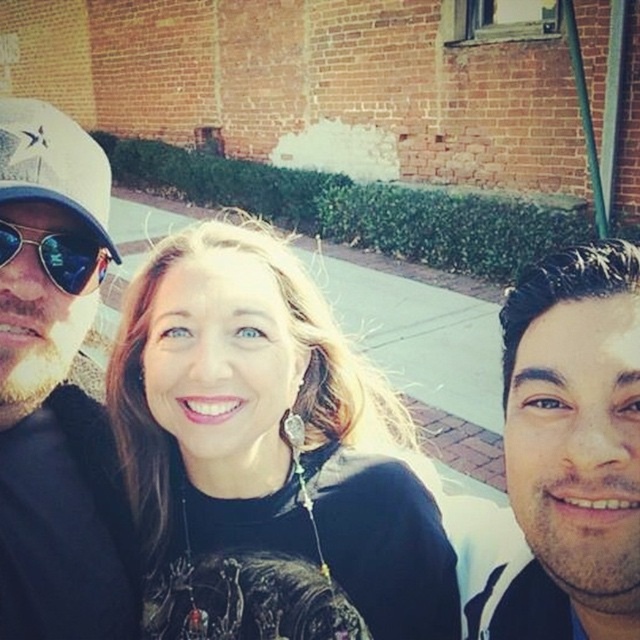
Measure the distance between white matte face at right and camera.

The distance of white matte face at right from camera is 26.31 inches.

Can you confirm if white matte face at right is positioned to the right of matte black sunglasses at left?

Yes, white matte face at right is to the right of matte black sunglasses at left.

Locate an element on the screen. This screenshot has height=640, width=640. white matte face at right is located at coordinates (x=570, y=451).

Does matte black shirt at center come in front of matte black cap at left?

That is False.

Which is behind, point (182, 339) or point (38, 260)?

The point (182, 339) is behind.

Is point (388, 604) positioned after point (96, 227)?

Yes, it is.

I want to click on matte black shirt at center, so click(269, 429).

Does point (298, 492) come closer to viewer compared to point (83, 259)?

No, it is behind (83, 259).

Looking at this image, who is higher up, matte black shirt at center or matte black sunglasses at left?

matte black sunglasses at left is above.

Is point (177, 452) in front of point (4, 257)?

No, (177, 452) is further to viewer.

Find the location of a particular element. This screenshot has width=640, height=640. matte black shirt at center is located at coordinates tap(269, 429).